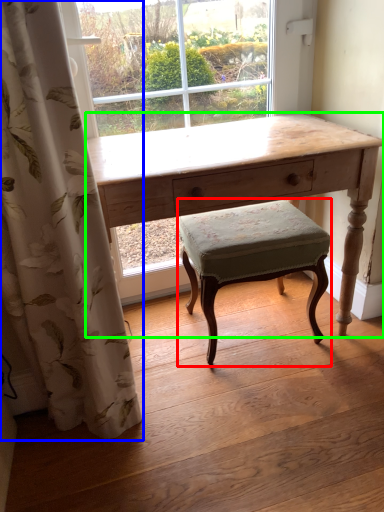
Question: Based on their relative distances, which object is farther from stool (highlighted by a red box)? Choose from curtain (highlighted by a blue box) and desk (highlighted by a green box).

Choices:
 (A) curtain
 (B) desk

Answer: (A)